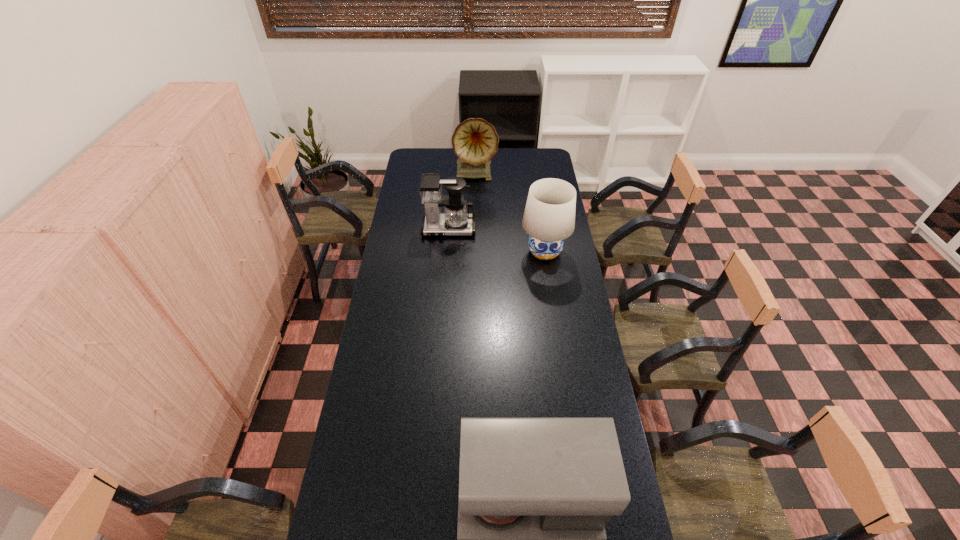
At what (x,y) coordinates should I click in order to perform the action: click on vacant space at the left edge of the desktop. Please return your answer as a coordinate pair (x, y). Looking at the image, I should click on (365, 534).

You are a GUI agent. You are given a task and a screenshot of the screen. Output one action in this format:
    pyautogui.click(x=<x>, y=<y>)
    Task: Click on the free space at the right edge
    
    Given the screenshot: What is the action you would take?
    pyautogui.click(x=560, y=380)

Identify the location of vacant point at the far left corner. (431, 166).

In order to click on vacant space at the far right corner of the desktop in this screenshot , I will do (x=531, y=162).

You are a GUI agent. You are given a task and a screenshot of the screen. Output one action in this format:
    pyautogui.click(x=<x>, y=<y>)
    Task: Click on the free space that is in between the lampshade and the farther coffee maker
    
    Given the screenshot: What is the action you would take?
    pyautogui.click(x=496, y=240)

The width and height of the screenshot is (960, 540). I want to click on vacant space in between the record player and the lampshade, so click(510, 213).

Locate which object is the third closest to the shorter coffee maker. Please provide its 2D coordinates. Your answer should be formatted as a tuple, i.e. [(x, y)], where the tuple contains the x and y coordinates of a point satisfying the conditions above.

[(535, 494)]

At what (x,y) coordinates should I click in order to perform the action: click on object that is the closest one to the record player. Please return your answer as a coordinate pair (x, y). Image resolution: width=960 pixels, height=540 pixels. Looking at the image, I should click on (456, 221).